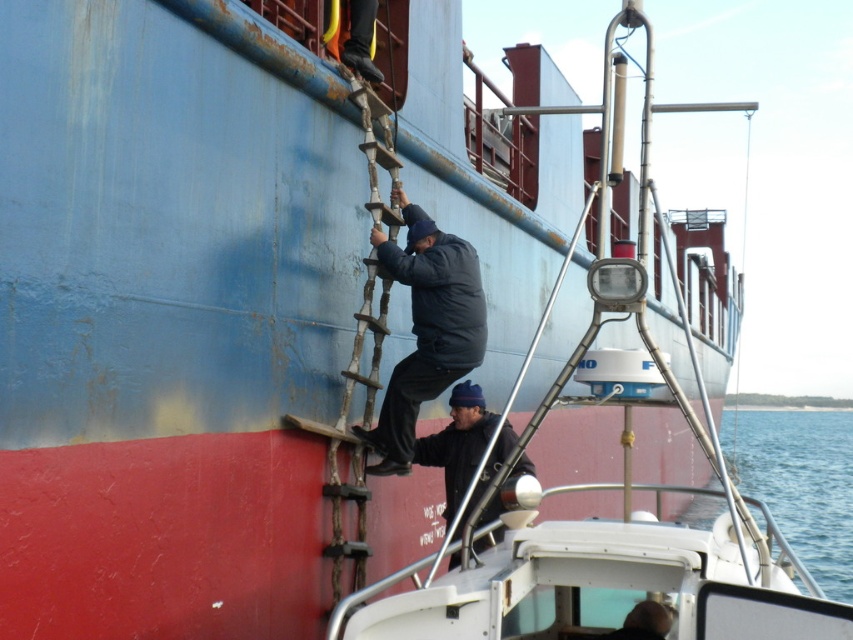
You are a sailor trying to board the ship using the metal ladder. You notice the dark blue knit cap at center and the blue water at lower right. Which object is closer to you as you climb the ladder?

The dark blue knit cap at center is behind the blue water at lower right, so the blue water at lower right is closer to you as you climb the ladder.

Looking at this image, you are a safety inspector evaluating the boarding process of the ship. You notice two items in the scene that could pose safety risks. The first item is the dark blue padded jacket at center, and the second is the wooden at left. Based on their positions, which item is more likely to cause a slipping hazard for the climbers?

The dark blue padded jacket at center is positioned over wooden at left, so the dark blue padded jacket at center is more likely to cause a slipping hazard as it is above and could fall onto the wooden at left, creating a dangerous situation.

You are standing on the deck of the ship and looking down. You see the blue water at lower right and the dark blue padded jacket at center. Which object is closer to you?

The dark blue padded jacket at center is closer to you because it is above the blue water at lower right, which is located below it.